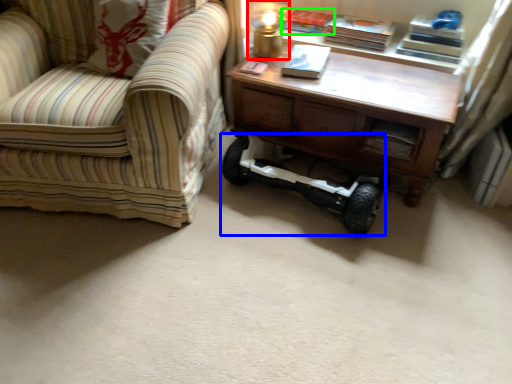
Question: Considering the real-world distances, which object is farthest from table lamp (highlighted by a red box)? segway (highlighted by a blue box) or book (highlighted by a green box)?

Choices:
 (A) segway
 (B) book

Answer: (A)